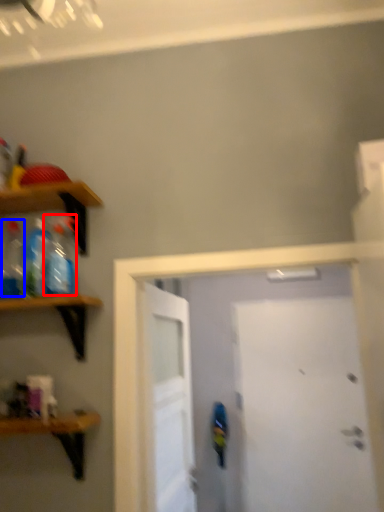
Question: Which object is further to the camera taking this photo, bottle (highlighted by a red box) or bottle (highlighted by a blue box)?

Choices:
 (A) bottle
 (B) bottle

Answer: (B)